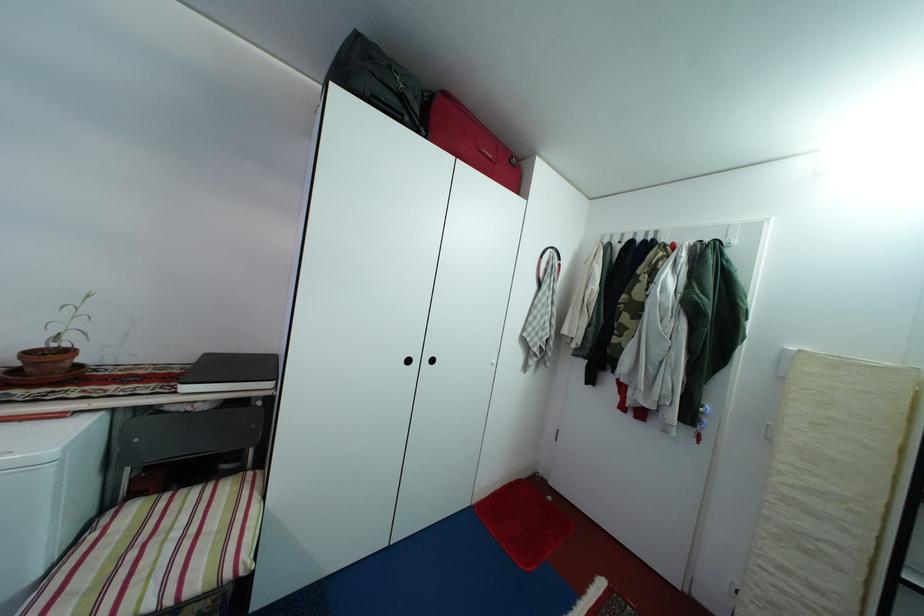
This screenshot has height=616, width=924. Describe the element at coordinates (156, 551) in the screenshot. I see `the striped chair sitting surface` at that location.